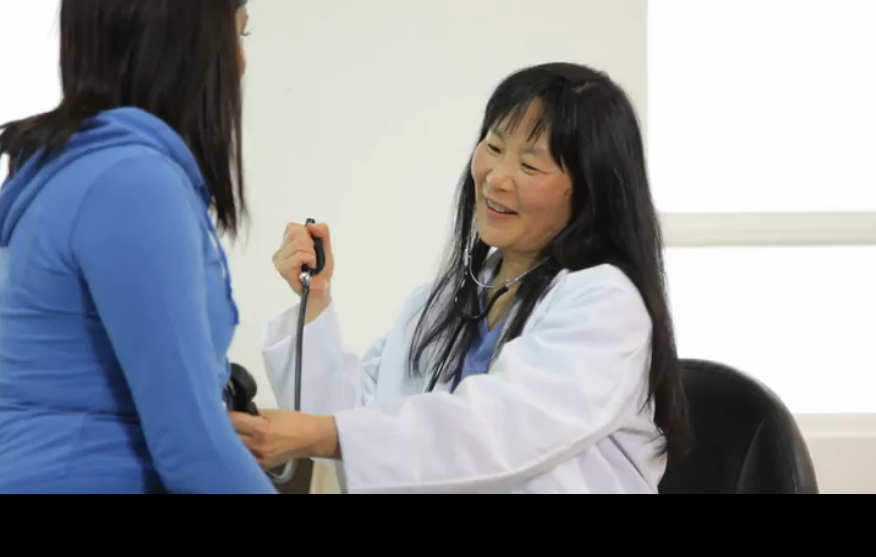
Where is `cord`? The height and width of the screenshot is (557, 876). cord is located at coordinates pos(283,343).